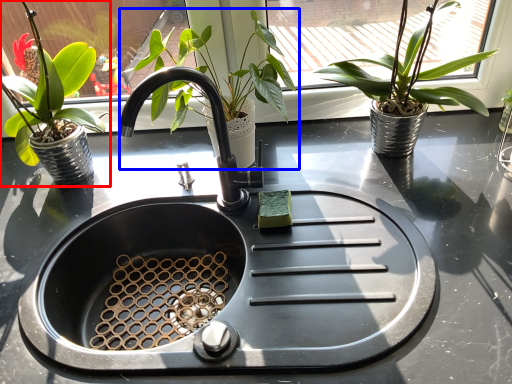
Question: Which object appears farthest to the camera in this image, houseplant (highlighted by a red box) or houseplant (highlighted by a blue box)?

Choices:
 (A) houseplant
 (B) houseplant

Answer: (B)